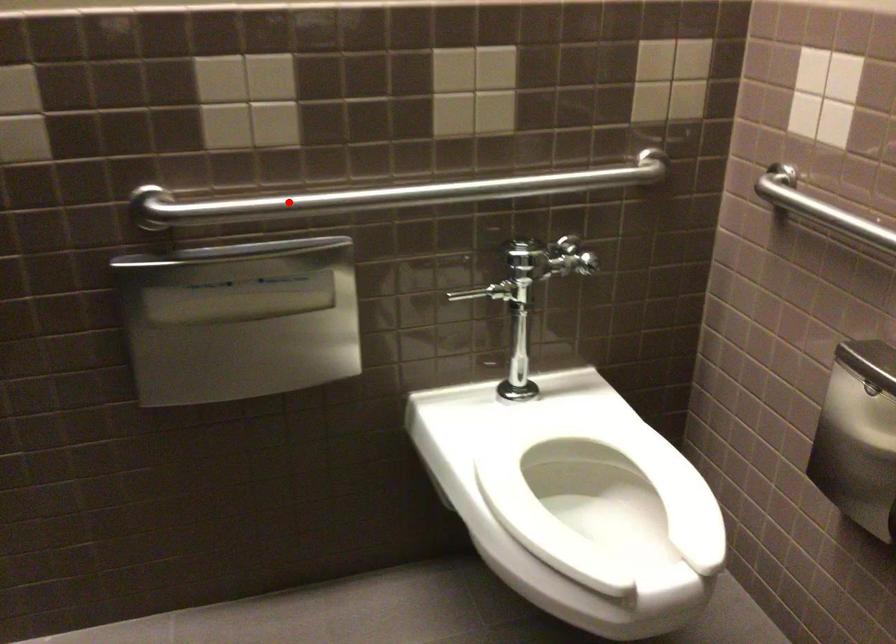
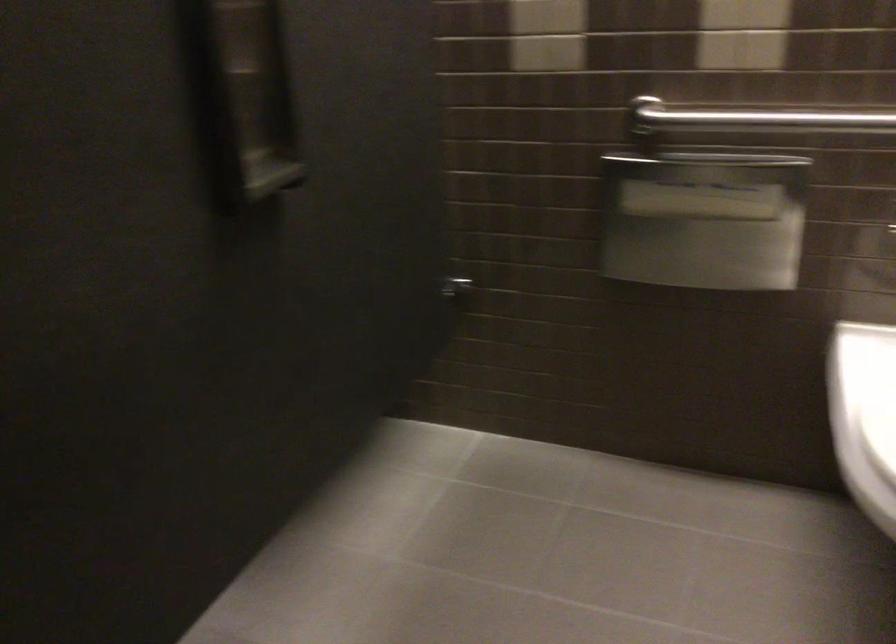
Find the pixel in the second image that matches the highlighted location in the first image.

(751, 116)